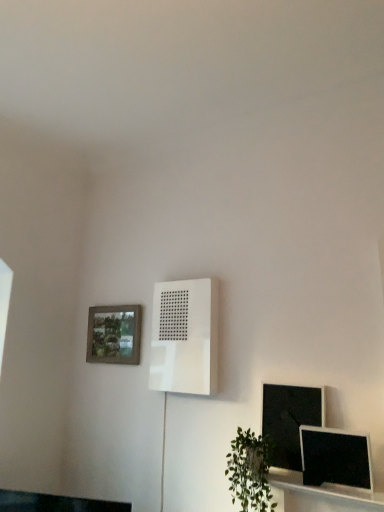
Question: Is wooden textured picture frame at upper left at the right side of green leafy plant at lower right?

Choices:
 (A) no
 (B) yes

Answer: (A)

Question: From the image's perspective, does wooden textured picture frame at upper left appear lower than green leafy plant at lower right?

Choices:
 (A) no
 (B) yes

Answer: (A)

Question: Can you confirm if wooden textured picture frame at upper left is shorter than green leafy plant at lower right?

Choices:
 (A) yes
 (B) no

Answer: (A)

Question: Is wooden textured picture frame at upper left bigger than green leafy plant at lower right?

Choices:
 (A) no
 (B) yes

Answer: (A)

Question: Does wooden textured picture frame at upper left contain green leafy plant at lower right?

Choices:
 (A) no
 (B) yes

Answer: (A)

Question: Is there a large distance between wooden textured picture frame at upper left and green leafy plant at lower right?

Choices:
 (A) yes
 (B) no

Answer: (A)

Question: Considering the relative sizes of matte black monitor at lower right, marked as the first computer monitor in a front-to-back arrangement, and green leafy plant at lower right in the image provided, is matte black monitor at lower right, marked as the first computer monitor in a front-to-back arrangement, smaller than green leafy plant at lower right?

Choices:
 (A) no
 (B) yes

Answer: (B)

Question: Considering the relative sizes of matte black monitor at lower right, marked as the second computer monitor in a back-to-front arrangement, and green leafy plant at lower right in the image provided, is matte black monitor at lower right, marked as the second computer monitor in a back-to-front arrangement, taller than green leafy plant at lower right?

Choices:
 (A) no
 (B) yes

Answer: (A)

Question: Would you consider matte black monitor at lower right, marked as the second computer monitor in a back-to-front arrangement, to be distant from green leafy plant at lower right?

Choices:
 (A) no
 (B) yes

Answer: (A)

Question: From a real-world perspective, is matte black monitor at lower right, marked as the second computer monitor in a back-to-front arrangement, on top of green leafy plant at lower right?

Choices:
 (A) no
 (B) yes

Answer: (B)

Question: Is matte black monitor at lower right, marked as the first computer monitor in a front-to-back arrangement, located outside green leafy plant at lower right?

Choices:
 (A) no
 (B) yes

Answer: (B)

Question: Is green leafy plant at lower right a part of matte black monitor at lower right, marked as the second computer monitor in a back-to-front arrangement?

Choices:
 (A) no
 (B) yes

Answer: (A)

Question: Is matte black monitor at lower right, marked as the second computer monitor in a back-to-front arrangement, far away from white matte air conditioner at center?

Choices:
 (A) no
 (B) yes

Answer: (A)